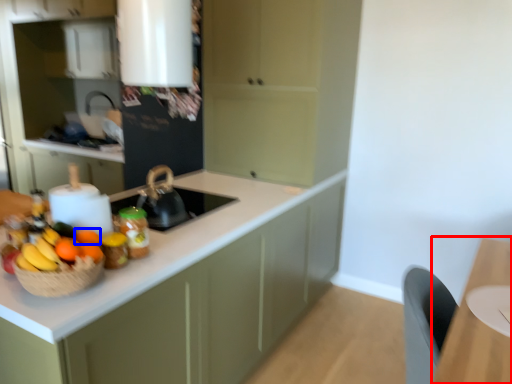
Question: Among these objects, which one is farthest to the camera, table (highlighted by a red box) or orange (highlighted by a blue box)?

Choices:
 (A) table
 (B) orange

Answer: (B)